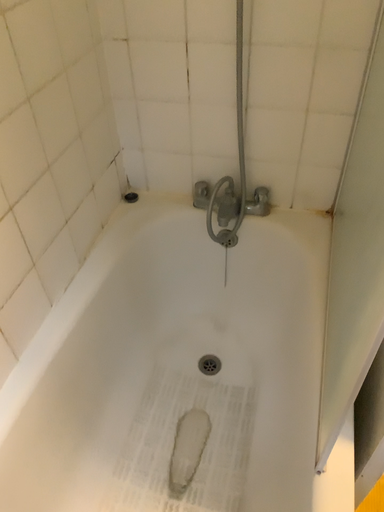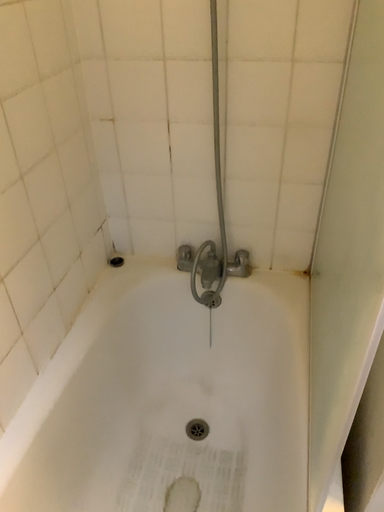
Question: Which way did the camera rotate in the video?

Choices:
 (A) rotated upward
 (B) rotated downward

Answer: (A)